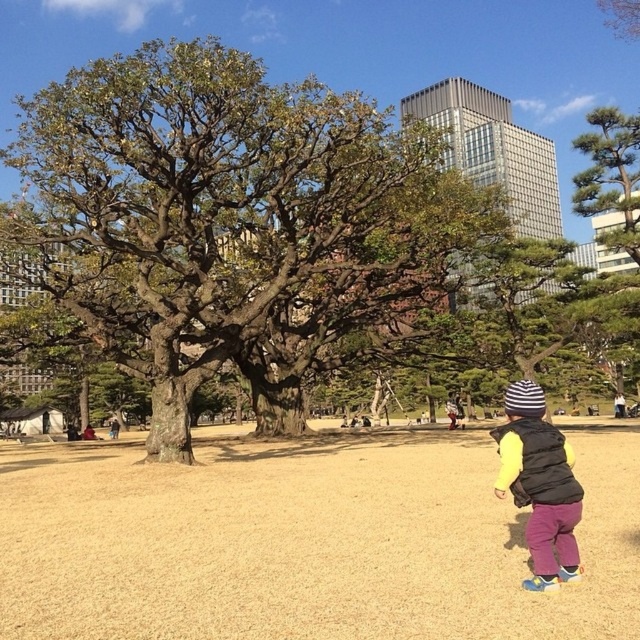
You are a park visitor trying to decide which tree to sit under for shade. The brown textured oak tree at center and the green textured pine tree at upper right are both options. Which tree would provide more shade based on their sizes?

The brown textured oak tree at center is larger in size than the green textured pine tree at upper right, so it would provide more shade.

You are a gardener planning to plant a new pine tree in the park. You notice the brown dry grass at center and the green textured pine tree at upper right. Which area has more space to accommodate the new pine tree?

The brown dry grass at center has more space because it is bigger than the green textured pine tree at upper right.

You are standing at the point marked as point (305, 541) in the image. Looking around, what do you see directly in front of you?

You see brown dry grass at center directly in front of you at point (305, 541).